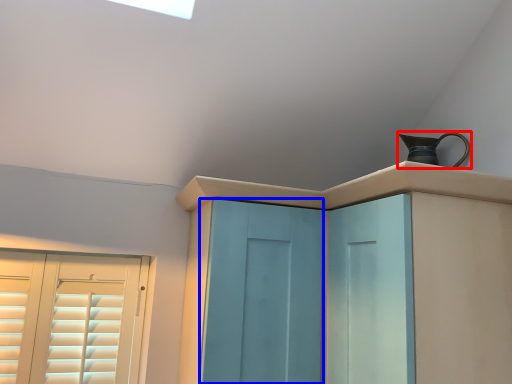
Question: Among these objects, which one is farthest to the camera, jug (highlighted by a red box) or screen door (highlighted by a blue box)?

Choices:
 (A) jug
 (B) screen door

Answer: (A)